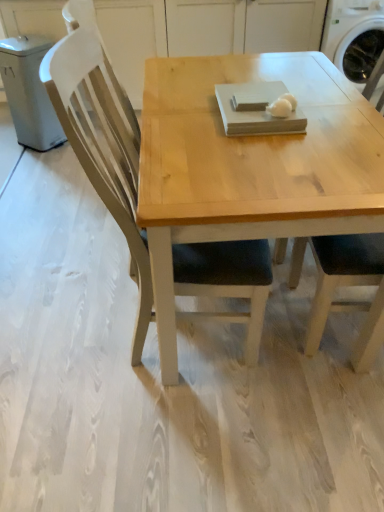
Question: Is there a large distance between matte wood chair at right and white matte egg at center?

Choices:
 (A) no
 (B) yes

Answer: (A)

Question: Does matte wood chair at right turn towards white matte egg at center?

Choices:
 (A) yes
 (B) no

Answer: (A)

Question: From the image's perspective, would you say matte wood chair at right is positioned over white matte egg at center?

Choices:
 (A) no
 (B) yes

Answer: (A)

Question: From a real-world perspective, is matte wood chair at right beneath white matte egg at center?

Choices:
 (A) yes
 (B) no

Answer: (A)

Question: Is matte wood chair at right smaller than white matte egg at center?

Choices:
 (A) no
 (B) yes

Answer: (A)

Question: Is matte wood chair at right positioned with its back to white matte egg at center?

Choices:
 (A) no
 (B) yes

Answer: (A)

Question: From the image's perspective, would you say white matte egg at center is shown under white plastic washing machine at upper right?

Choices:
 (A) yes
 (B) no

Answer: (A)

Question: Considering the relative sizes of white matte egg at center and white plastic washing machine at upper right in the image provided, is white matte egg at center shorter than white plastic washing machine at upper right?

Choices:
 (A) no
 (B) yes

Answer: (B)

Question: Is white matte egg at center aimed at white plastic washing machine at upper right?

Choices:
 (A) yes
 (B) no

Answer: (B)

Question: Is white matte egg at center wider than white plastic washing machine at upper right?

Choices:
 (A) yes
 (B) no

Answer: (B)

Question: Considering the relative sizes of white matte egg at center and white plastic washing machine at upper right in the image provided, is white matte egg at center smaller than white plastic washing machine at upper right?

Choices:
 (A) no
 (B) yes

Answer: (B)

Question: Is there a large distance between white matte egg at center and white plastic washing machine at upper right?

Choices:
 (A) yes
 (B) no

Answer: (A)

Question: From a real-world perspective, is white plastic washing machine at upper right positioned over white matte egg at center based on gravity?

Choices:
 (A) yes
 (B) no

Answer: (B)